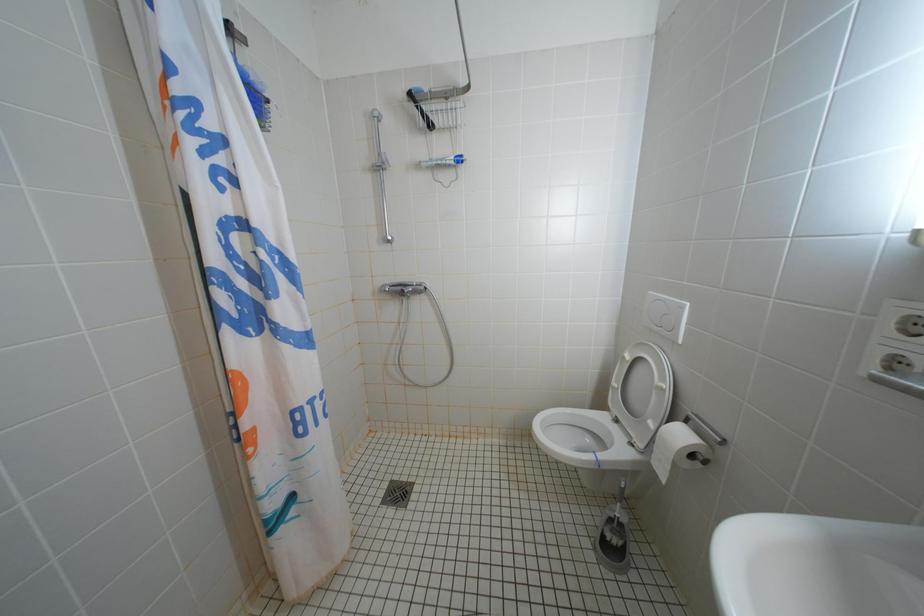
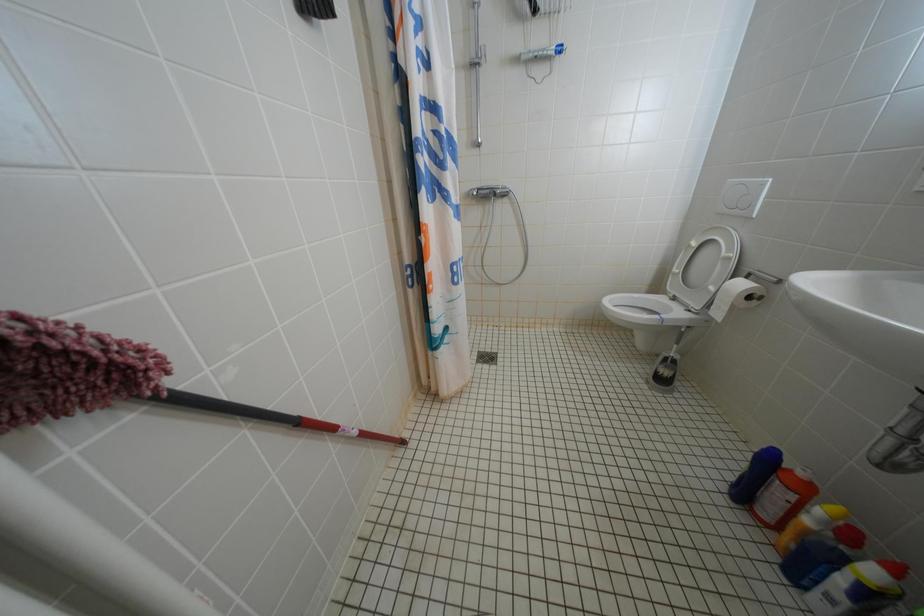
Question: The images are taken continuously from a first-person perspective. In which direction is your viewpoint rotating?

Choices:
 (A) Left
 (B) Right
 (C) Up
 (D) Down

Answer: (D)